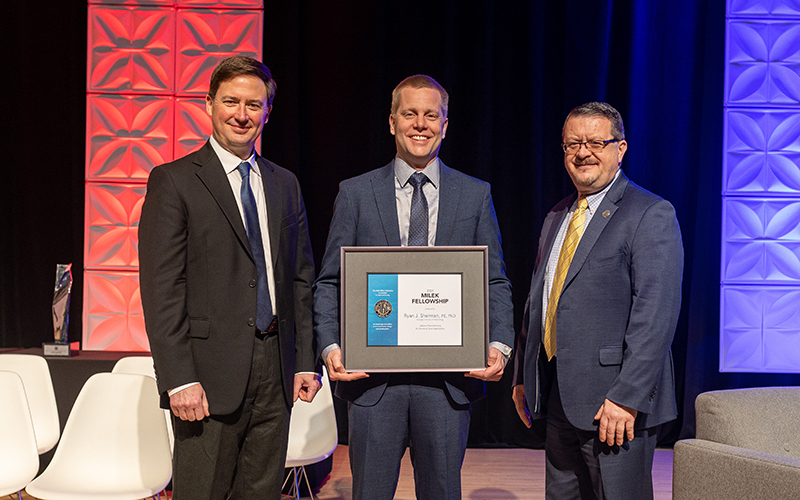
Identify the location of dark blue curtain. The image size is (800, 500). (701, 275), (682, 177), (681, 63).